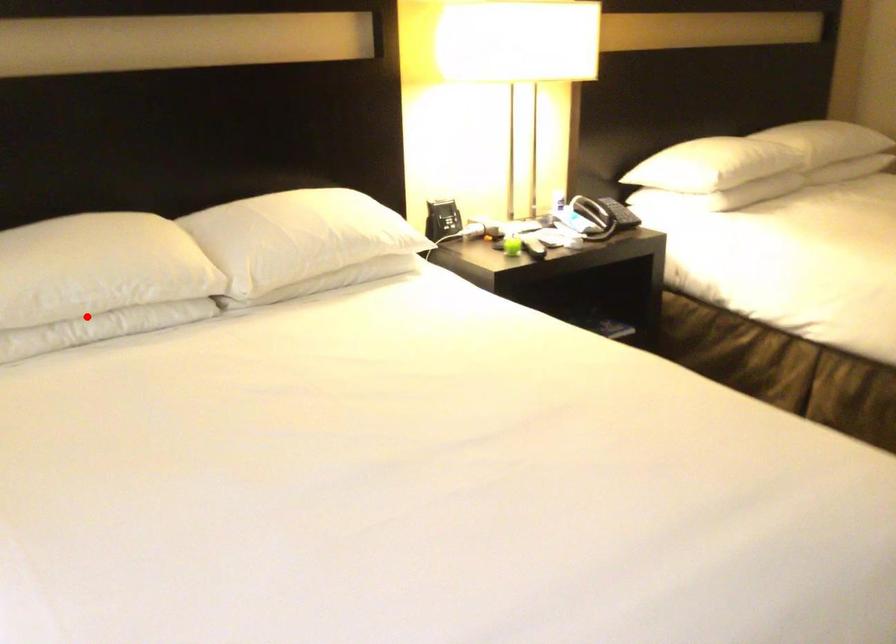
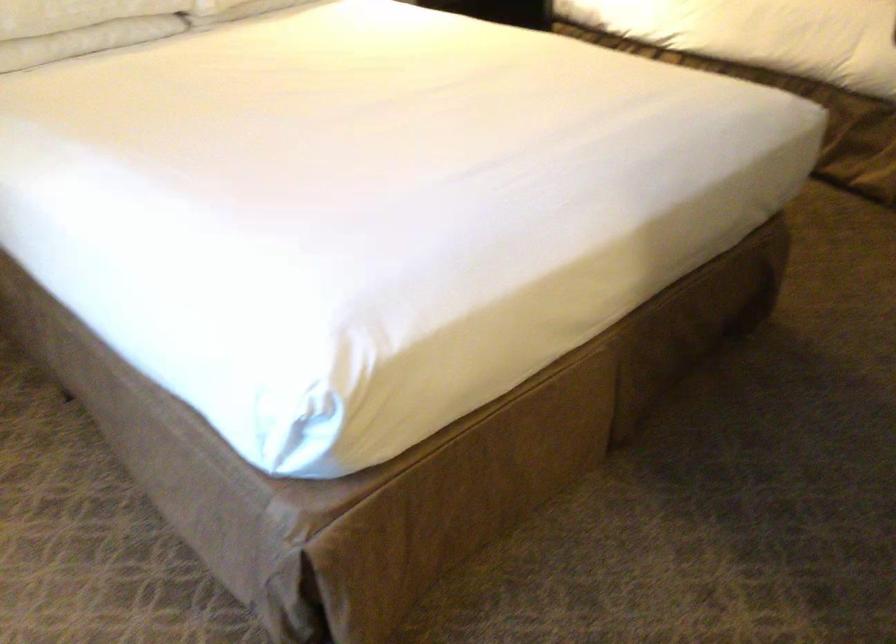
Question: I am providing you with two images of the same scene from different viewpoints. A red point is shown in image1. For the corresponding object point in image2, is it positioned nearer or farther from the camera?

Choices:
 (A) Nearer
 (B) Farther

Answer: (B)